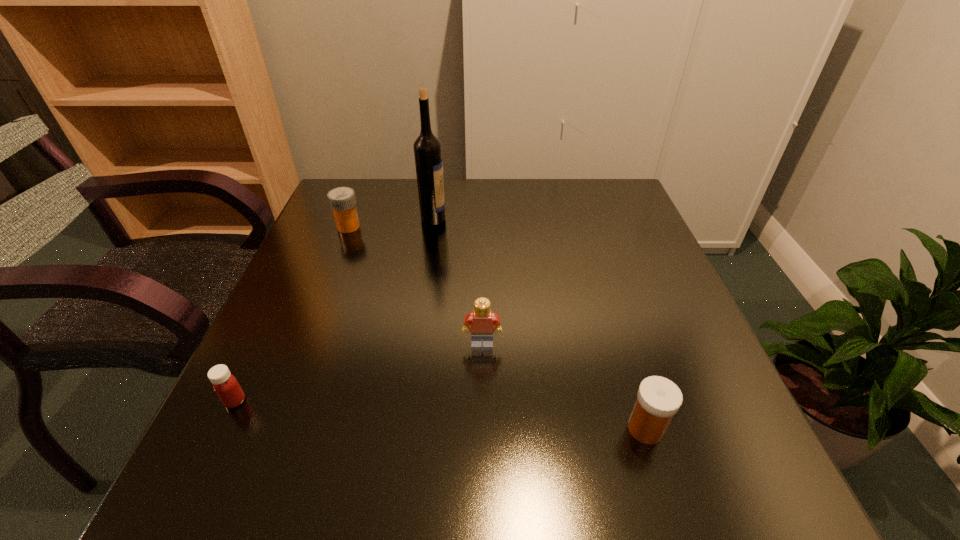
Where is `free region located 0.240m on the label of the tallest object`? The width and height of the screenshot is (960, 540). free region located 0.240m on the label of the tallest object is located at coordinates (537, 218).

You are a GUI agent. You are given a task and a screenshot of the screen. Output one action in this format:
    pyautogui.click(x=<x>, y=<y>)
    Task: Click on the vacant area situated on the front-facing side of the Lego
    
    Given the screenshot: What is the action you would take?
    pyautogui.click(x=483, y=478)

Identify the location of vacant region located on the label side of the farthest medicine. click(450, 227).

This screenshot has width=960, height=540. What are the coordinates of `vacant area situated on the back of the rightmost object` in the screenshot? It's located at (608, 306).

At what (x,y) coordinates should I click in order to perform the action: click on free region located 0.160m on the right of the shortest object. Please return your answer as a coordinate pair (x, y). Looking at the image, I should click on (340, 401).

Image resolution: width=960 pixels, height=540 pixels. What are the coordinates of `wine bottle present at the far edge` in the screenshot? It's located at (427, 148).

At what (x,y) coordinates should I click in order to perform the action: click on medicine present at the far edge. Please return your answer as a coordinate pair (x, y). The height and width of the screenshot is (540, 960). Looking at the image, I should click on (342, 201).

Where is `object that is at the right edge`? Image resolution: width=960 pixels, height=540 pixels. object that is at the right edge is located at coordinates (658, 399).

Identify the location of object that is at the far left corner. (342, 201).

Image resolution: width=960 pixels, height=540 pixels. I want to click on vacant area at the far edge, so click(478, 196).